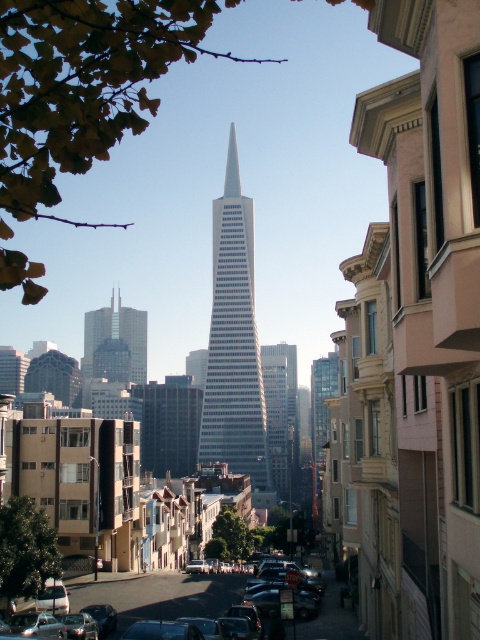
You are an architect analyzing the urban skyline. You observe the white glass skyscraper at center and the matte glass skyscraper at center. Which of these two skyscrapers has a greater height?

The white glass skyscraper at center is larger in size than the matte glass skyscraper at center, so it has a greater height.

You are standing at point A located at coordinates point A at (200, 612). You want to walk to point B which is 210.88 feet away. Is there a clear path between these two points, or will you need to navigate around any obstacles?

The distance between point A at (200, 612) and point B is 210.88 feet. Since the scene shows a street with parked cars and buildings, you may need to navigate around parked cars or other obstacles along the way.

You are a photographer standing on the sidewalk and want to capture both the white glass skyscraper at center and the metallic silver car at center in a single photo. Which object will appear larger in the photo?

The white glass skyscraper at center will appear larger in the photo because it is much taller than the metallic silver car at center.